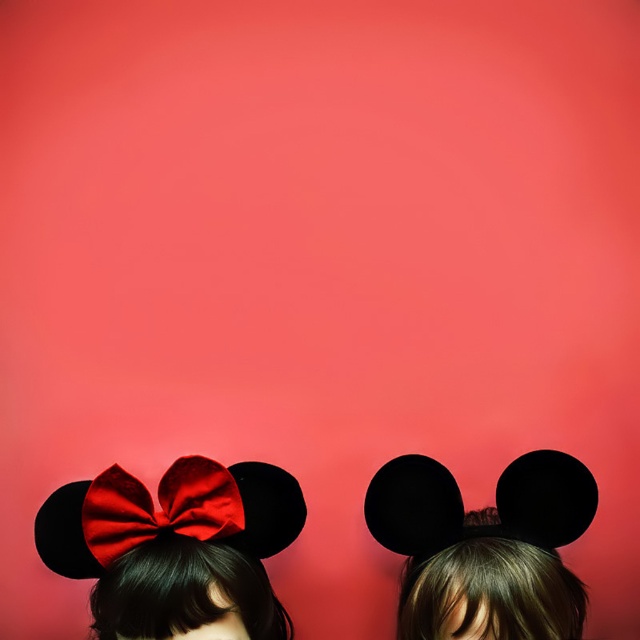
In the scene shown: You are standing in front of the image. There is a black matte mouse ears at center represented by point (484, 547). Can you tell me where the black matte mouse ears at center is located in the image?

The black matte mouse ears at center is located at point (484, 547) in the image.

You are holding a 36 inch long pole. You want to reach a point marked at point (512, 570). Can you reach it with your pole?

The distance of point (512, 570) from camera is 34.52 inches. Since the pole is 36 inches long, you can reach the point with the pole.

You are designing a poster and want to place the satin red bow at upper left and the black matte mouse ears at center. Since the poster has limited vertical space, will the taller object fit within the 12 inch height limit?

The satin red bow at upper left is taller than the black matte mouse ears at center. Therefore, the taller object, the satin red bow at upper left, must be under 12 inches to fit. If it exceeds 12 inches, it won not fit.